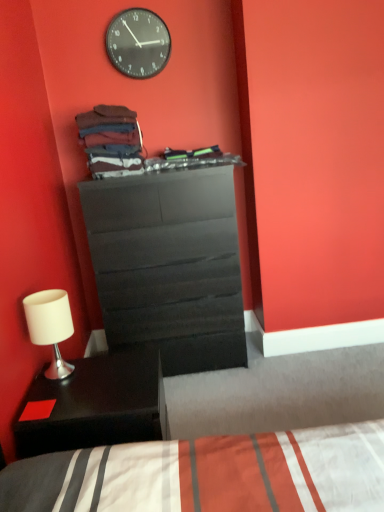
I want to click on vacant area that is in front of white matte table lamp at lower left, so click(55, 397).